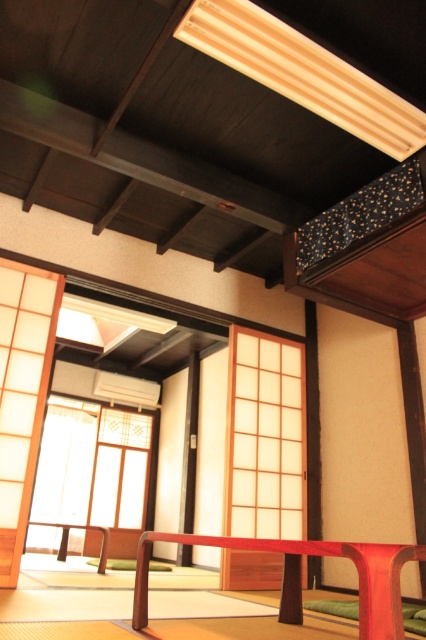
Question: Does translucent paper window at center appear under matte red table at center?

Choices:
 (A) yes
 (B) no

Answer: (A)

Question: Among these points, which one is nearest to the camera?

Choices:
 (A) (362, 608)
 (B) (249, 333)

Answer: (A)

Question: Observing the image, what is the correct spatial positioning of translucent wood window at center in reference to matte red table at center?

Choices:
 (A) left
 (B) right

Answer: (B)

Question: Which object is farther from the camera taking this photo?

Choices:
 (A) matte red table at center
 (B) translucent wood window at center

Answer: (B)

Question: Which object appears closest to the camera in this image?

Choices:
 (A) translucent wood window at center
 (B) translucent paper window at center

Answer: (A)

Question: Can you confirm if translucent wood window at center is positioned above translucent paper window at center?

Choices:
 (A) no
 (B) yes

Answer: (B)